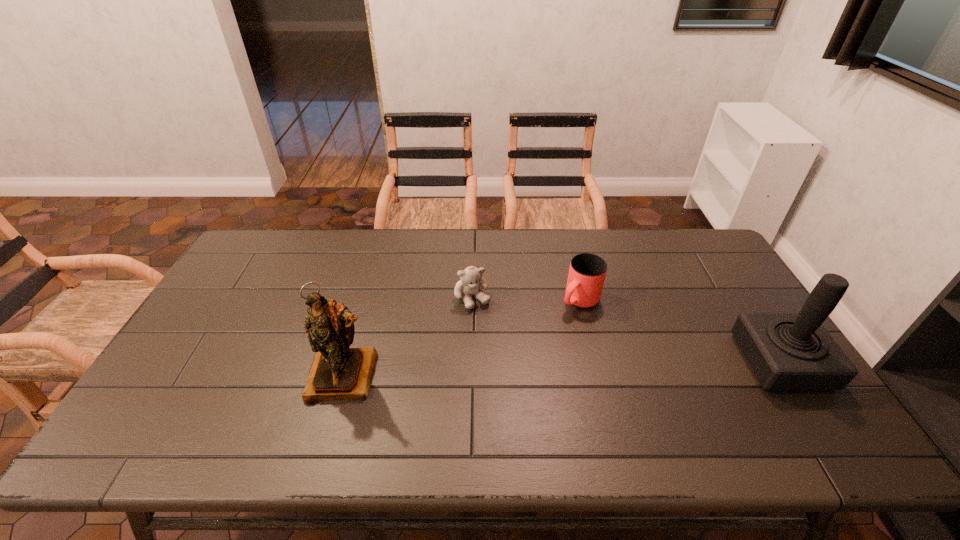
The height and width of the screenshot is (540, 960). I want to click on free region at the far right corner, so click(x=679, y=259).

Image resolution: width=960 pixels, height=540 pixels. I want to click on free area in between the cup and the leftmost object, so click(463, 338).

Where is `vacant area between the figurine and the cup`? vacant area between the figurine and the cup is located at coordinates (463, 338).

At what (x,y) coordinates should I click in order to perform the action: click on vacant space that's between the joystick and the leftmost object. Please return your answer as a coordinate pair (x, y). This screenshot has height=540, width=960. Looking at the image, I should click on (563, 369).

Identify the location of vacant area that lies between the joystick and the figurine. (563, 369).

Find the location of a particular element. This screenshot has height=540, width=960. unoccupied position between the second object from left to right and the leftmost object is located at coordinates (409, 337).

Identify the location of vacant area between the cup and the leftmost object. The width and height of the screenshot is (960, 540). (463, 338).

In order to click on vacant area that lies between the rightmost object and the figurine in this screenshot , I will do `click(563, 369)`.

The width and height of the screenshot is (960, 540). Find the location of `empty location between the third object from left to right and the joystick`. empty location between the third object from left to right and the joystick is located at coordinates (681, 331).

What are the coordinates of `free spot between the cup and the joystick` in the screenshot? It's located at (681, 331).